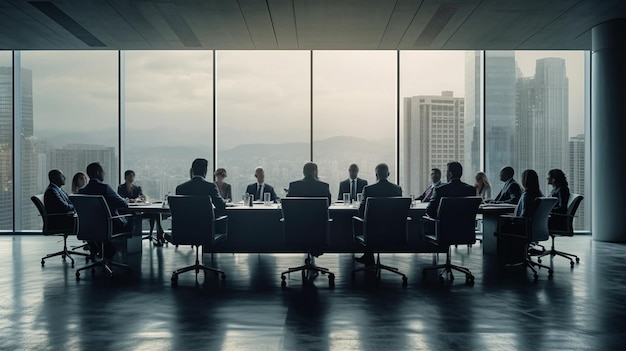
Locate an element on the screen. chairs is located at coordinates (90, 216), (59, 219), (146, 214), (198, 218), (308, 228), (377, 222), (456, 220), (541, 221), (573, 219).